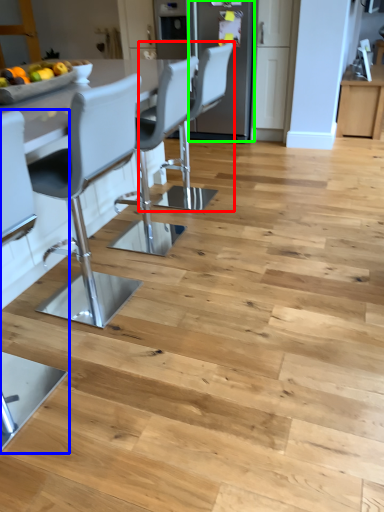
Question: Based on their relative distances, which object is farther from chair (highlighted by a red box)? Choose from chair (highlighted by a blue box) and appliance (highlighted by a green box).

Choices:
 (A) chair
 (B) appliance

Answer: (A)